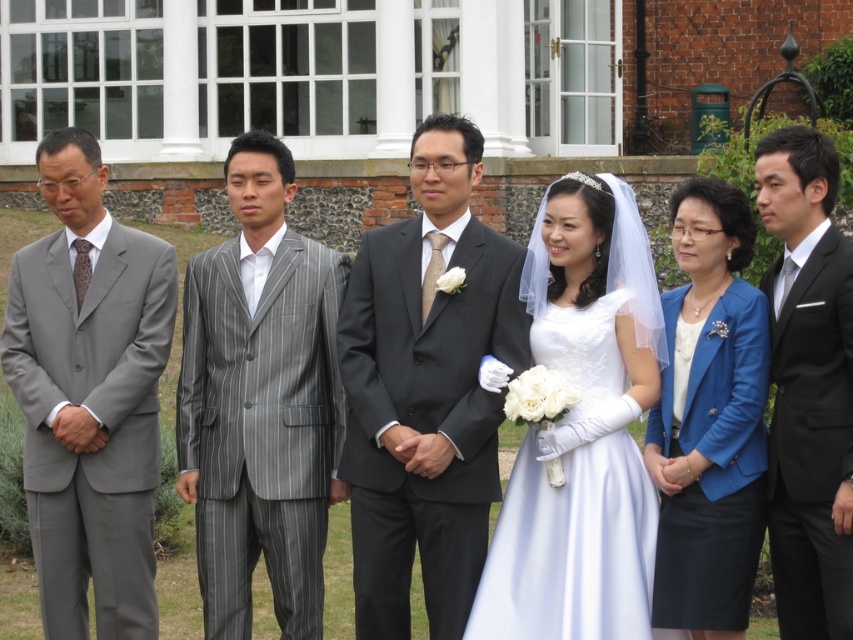
Is point (247, 384) closer to camera compared to point (42, 609)?

No, (247, 384) is further to viewer.

Between gray pinstripe suit at center and matte gray suit at left, which one has more height?

With more height is gray pinstripe suit at center.

You are a GUI agent. You are given a task and a screenshot of the screen. Output one action in this format:
    pyautogui.click(x=<x>, y=<y>)
    Task: Click on the gray pinstripe suit at center
    
    Given the screenshot: What is the action you would take?
    pyautogui.click(x=260, y=401)

Can you confirm if gray pinstripe suit at center is positioned below blue satin blazer at center?

Indeed, gray pinstripe suit at center is positioned under blue satin blazer at center.

Is gray pinstripe suit at center further to camera compared to blue satin blazer at center?

Yes.

Which is in front, point (294, 496) or point (682, 330)?

Point (682, 330)

This screenshot has width=853, height=640. I want to click on gray pinstripe suit at center, so click(x=260, y=401).

Is blue satin blazer at center thinner than white satin dress at center?

No.

Between point (666, 513) and point (526, 432), which one is positioned in front?

Positioned in front is point (666, 513).

Image resolution: width=853 pixels, height=640 pixels. I want to click on blue satin blazer at center, so click(709, 419).